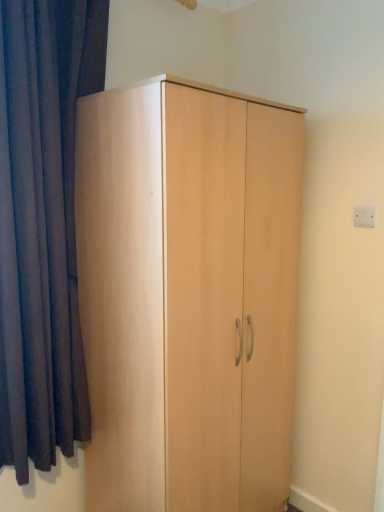
Question: Does dark blue fabric at left appear on the left side of light wood wardrobe at center?

Choices:
 (A) no
 (B) yes

Answer: (B)

Question: Is dark blue fabric at left with light wood wardrobe at center?

Choices:
 (A) no
 (B) yes

Answer: (A)

Question: From a real-world perspective, is dark blue fabric at left under light wood wardrobe at center?

Choices:
 (A) no
 (B) yes

Answer: (A)

Question: Is dark blue fabric at left not near light wood wardrobe at center?

Choices:
 (A) no
 (B) yes

Answer: (A)

Question: Is dark blue fabric at left not inside light wood wardrobe at center?

Choices:
 (A) yes
 (B) no

Answer: (A)

Question: Looking at the image, does dark blue fabric at left seem bigger or smaller compared to white plastic electric outlet at upper right?

Choices:
 (A) big
 (B) small

Answer: (A)

Question: Based on their positions, is dark blue fabric at left located to the left or right of white plastic electric outlet at upper right?

Choices:
 (A) right
 (B) left

Answer: (B)

Question: Relative to white plastic electric outlet at upper right, is dark blue fabric at left in front or behind?

Choices:
 (A) behind
 (B) front

Answer: (B)

Question: Is dark blue fabric at left situated inside white plastic electric outlet at upper right or outside?

Choices:
 (A) outside
 (B) inside

Answer: (A)

Question: Is white plastic electric outlet at upper right wider or thinner than light wood wardrobe at center?

Choices:
 (A) wide
 (B) thin

Answer: (B)

Question: From their relative heights in the image, would you say white plastic electric outlet at upper right is taller or shorter than light wood wardrobe at center?

Choices:
 (A) short
 (B) tall

Answer: (A)

Question: Looking at the image, does white plastic electric outlet at upper right seem bigger or smaller compared to light wood wardrobe at center?

Choices:
 (A) small
 (B) big

Answer: (A)

Question: Is point (357, 216) positioned closer to the camera than point (92, 99)?

Choices:
 (A) farther
 (B) closer

Answer: (A)

Question: Is light wood wardrobe at center to the left or to the right of dark blue fabric at left in the image?

Choices:
 (A) right
 (B) left

Answer: (A)

Question: From a real-world perspective, is light wood wardrobe at center physically located above or below dark blue fabric at left?

Choices:
 (A) below
 (B) above

Answer: (A)